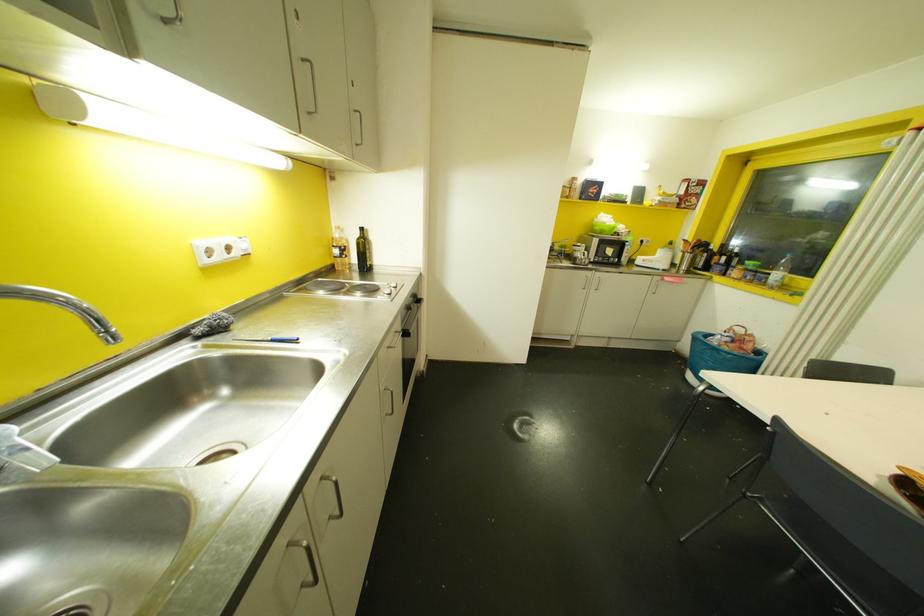
Find where to plugging in the white power outlet. Please return your answer as a coordinate pair (x, y).

(220, 249)